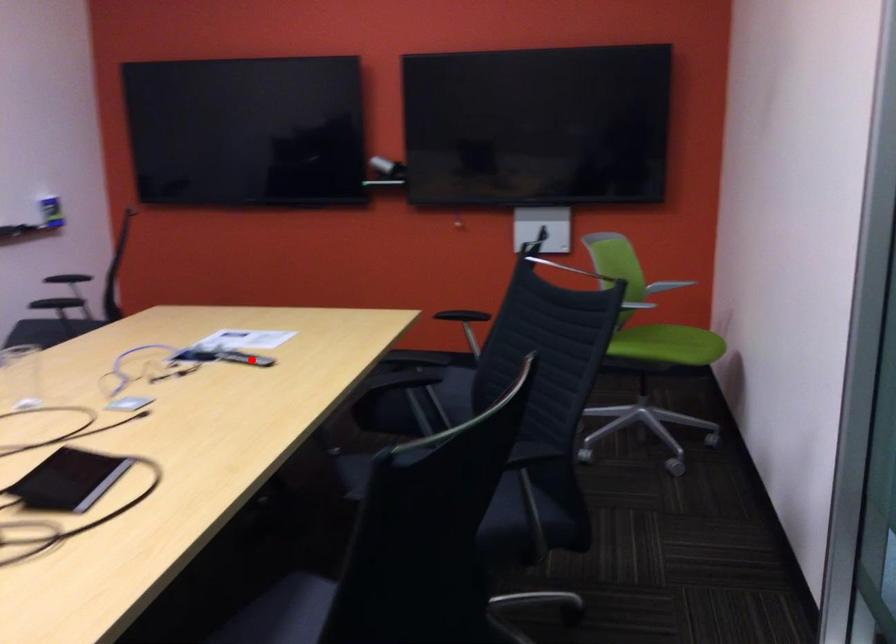
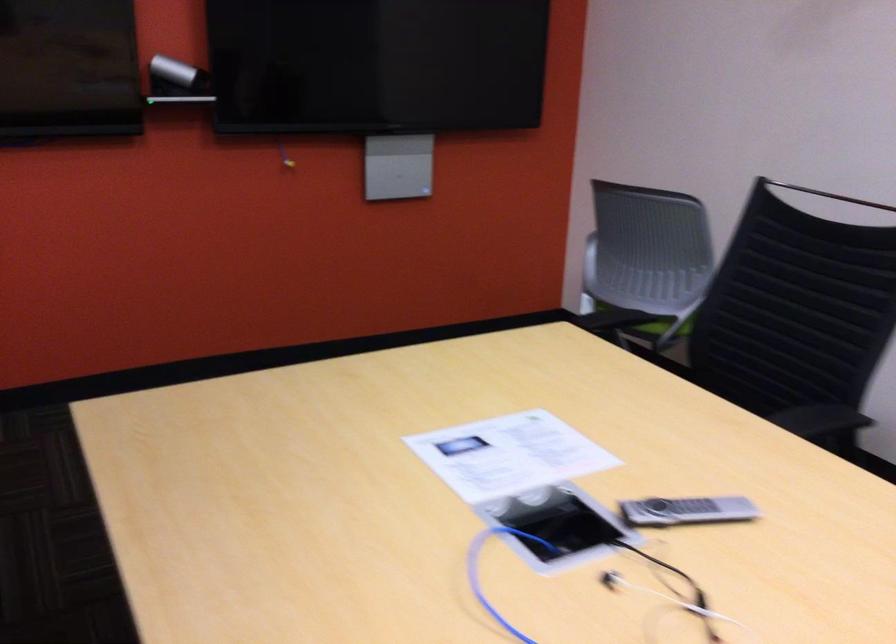
Question: I am providing you with two images of the same scene from different viewpoints. A red point is shown in image1. For the corresponding object point in image2, is it positioned nearer or farther from the camera?

Choices:
 (A) Nearer
 (B) Farther

Answer: (A)